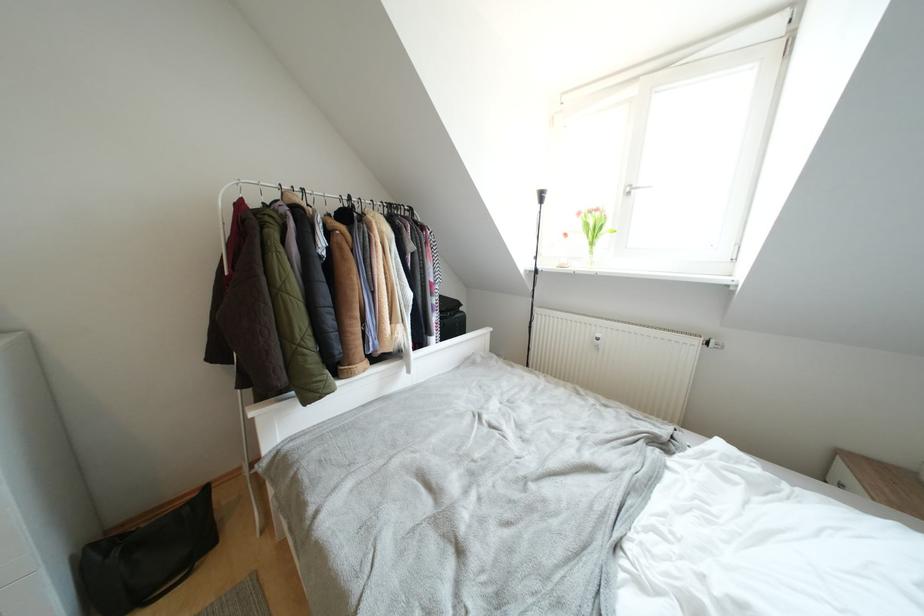
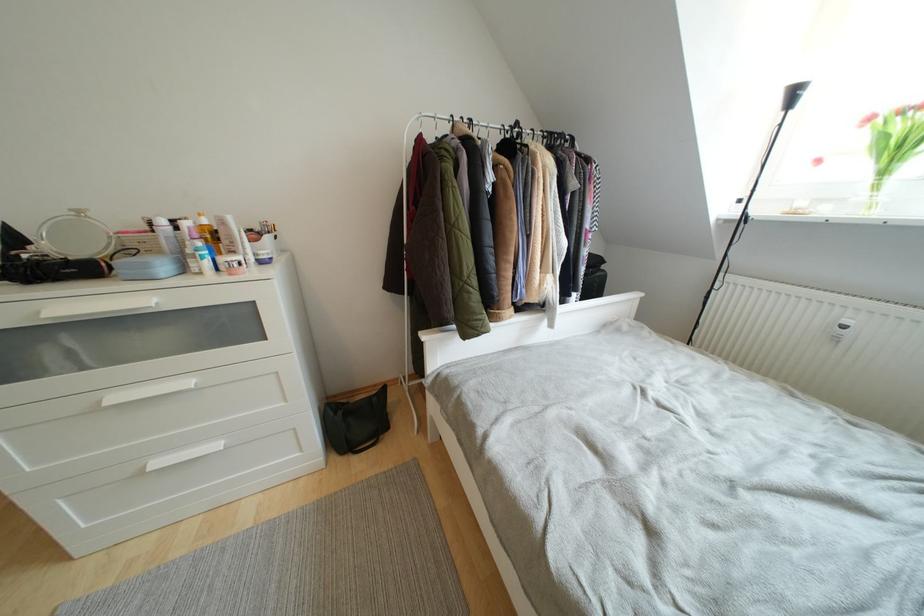
Question: The camera is either moving clockwise (left) or counter-clockwise (right) around the object. The first image is from the beginning of the video and the second image is from the end. Is the camera moving left or right when shooting the video?

Choices:
 (A) Left
 (B) Right

Answer: (B)